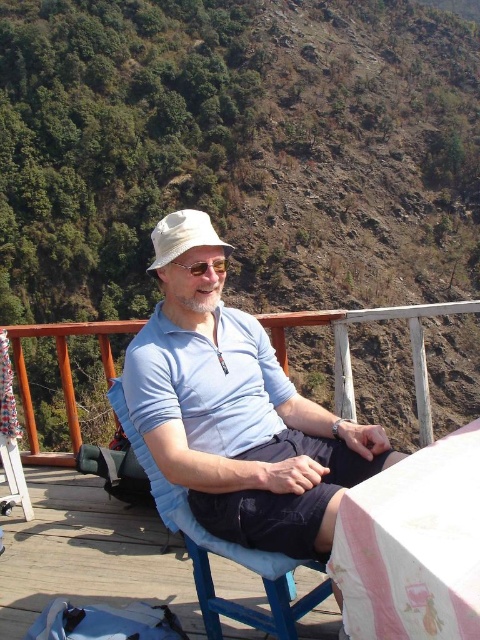
Question: Which of the following is the farthest from the observer?

Choices:
 (A) light blue cotton shirt at center
 (B) white fabric hat at center
 (C) green leafy hillside at upper left

Answer: (C)

Question: Which of the following is the farthest from the observer?

Choices:
 (A) 215,268
 (B) 348,358
 (C) 207,618
 (D) 213,449

Answer: (B)

Question: Does wooden deck at center appear on the right side of matte plastic sunglasses at center?

Choices:
 (A) yes
 (B) no

Answer: (A)

Question: Can you confirm if light blue cotton polo shirt at center is positioned to the left of matte plastic sunglasses at center?

Choices:
 (A) yes
 (B) no

Answer: (B)

Question: Which point appears farthest from the camera in this image?

Choices:
 (A) (420, 388)
 (B) (457, 636)
 (C) (132, 352)
 (D) (179, 227)

Answer: (A)

Question: Does light blue cotton polo shirt at center have a smaller size compared to matte plastic sunglasses at center?

Choices:
 (A) yes
 (B) no

Answer: (B)